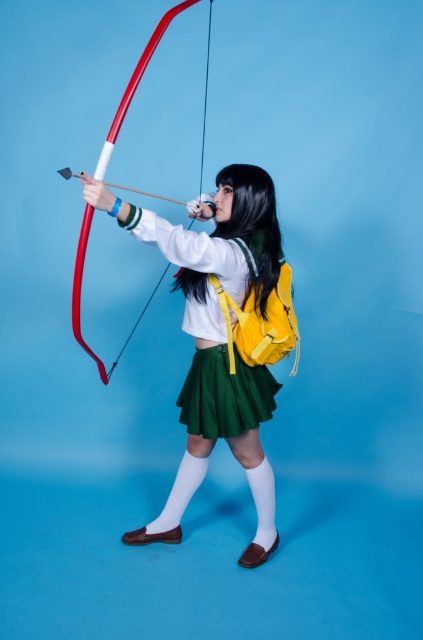
Question: Which of the following is the farthest from the observer?

Choices:
 (A) (183, 4)
 (B) (271, 237)

Answer: (B)

Question: Which point is farther from the camera taking this photo?

Choices:
 (A) (82, 220)
 (B) (246, 436)

Answer: (B)

Question: Does matte white sweater at center appear over shiny red bow at center?

Choices:
 (A) yes
 (B) no

Answer: (B)

Question: Is matte white sweater at center above shiny red bow at center?

Choices:
 (A) yes
 (B) no

Answer: (B)

Question: Can you confirm if matte white sweater at center is positioned to the right of shiny red bow at center?

Choices:
 (A) yes
 (B) no

Answer: (A)

Question: Which of the following is the farthest from the observer?

Choices:
 (A) (187, 433)
 (B) (134, 68)

Answer: (B)